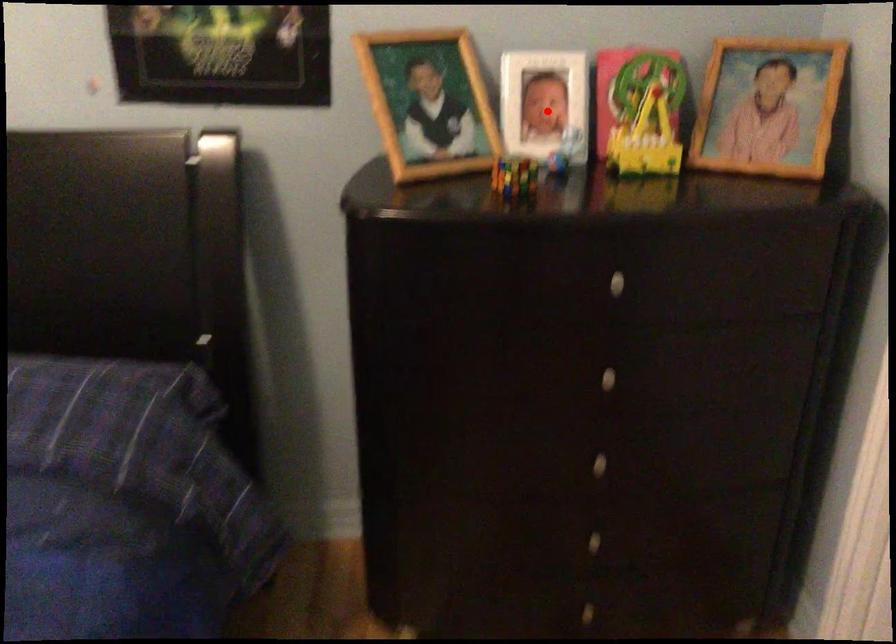
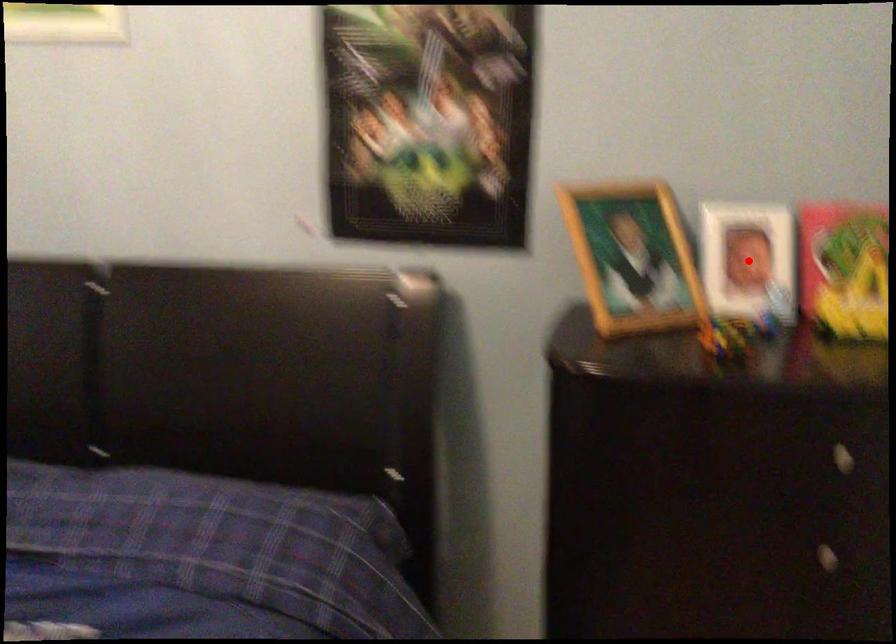
I am providing you with two images of the same scene from different viewpoints. A red point is marked on the first image and another point is marked on the second image. Is the marked point in image1 the same physical position as the marked point in image2?

Yes